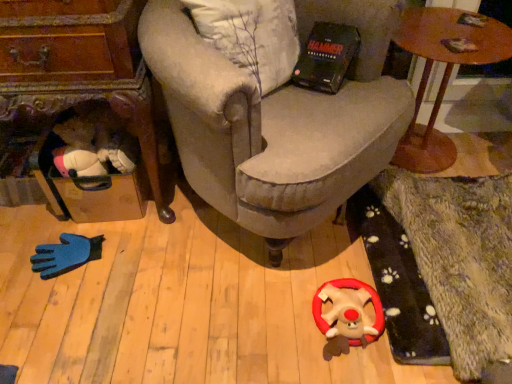
Where is `vacant space to the left of fluffy plush toy at center`? This screenshot has height=384, width=512. vacant space to the left of fluffy plush toy at center is located at coordinates (285, 331).